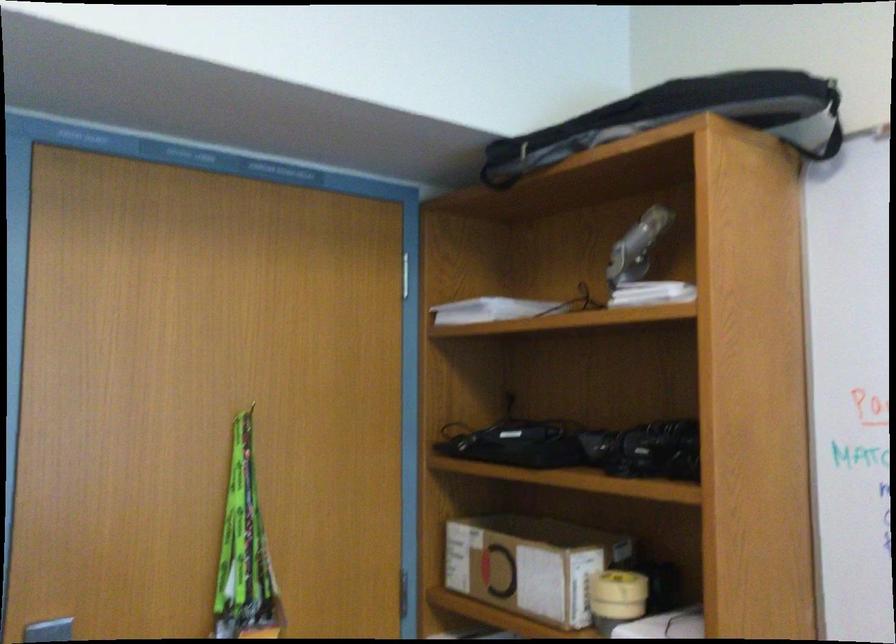
Describe the element at coordinates (244, 547) in the screenshot. This screenshot has height=644, width=896. I see `a green patterned lanyard` at that location.